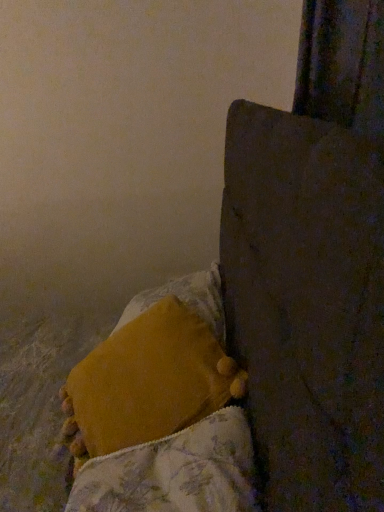
This screenshot has width=384, height=512. What do you see at coordinates (175, 472) in the screenshot?
I see `fluffy yellow blanket at lower left` at bounding box center [175, 472].

You are a GUI agent. You are given a task and a screenshot of the screen. Output one action in this format:
    pyautogui.click(x=<x>, y=<y>)
    Task: Click on the velvety yellow pillow at lower center
    Image resolution: width=384 pixels, height=512 pixels.
    Given the screenshot: What is the action you would take?
    pyautogui.click(x=148, y=382)

Which of these two, velvety yellow pillow at lower center or fluffy yellow blanket at lower left, is wider?

fluffy yellow blanket at lower left is wider.

How different are the orientations of velvety yellow pillow at lower center and fluffy yellow blanket at lower left in degrees?

The angular difference between velvety yellow pillow at lower center and fluffy yellow blanket at lower left is 0.601 degrees.

Based on the photo, is velvety yellow pillow at lower center next to fluffy yellow blanket at lower left?

No, velvety yellow pillow at lower center is not touching fluffy yellow blanket at lower left.

Which of these two, velvety yellow pillow at lower center or fluffy yellow blanket at lower left, is bigger?

velvety yellow pillow at lower center is bigger.

Locate an element on the screen. This screenshot has width=384, height=512. blanket behind the wooden bedpost at upper right is located at coordinates (175, 472).

From a real-world perspective, is fluffy yellow blanket at lower left physically below wooden bedpost at upper right?

Yes, from a real-world perspective, fluffy yellow blanket at lower left is beneath wooden bedpost at upper right.

Which is closer to the camera, (166, 450) or (300, 506)?

Point (166, 450).

Is fluffy yellow blanket at lower left aimed at wooden bedpost at upper right?

Yes, fluffy yellow blanket at lower left is turned towards wooden bedpost at upper right.

Is velvety yellow pillow at lower center to the left or to the right of wooden bedpost at upper right in the image?

Based on their positions, velvety yellow pillow at lower center is located to the right of wooden bedpost at upper right.

From the image's perspective, is velvety yellow pillow at lower center positioned above or below wooden bedpost at upper right?

velvety yellow pillow at lower center is situated lower than wooden bedpost at upper right in the image.

Is velvety yellow pillow at lower center facing away from wooden bedpost at upper right?

Correct, velvety yellow pillow at lower center is looking away from wooden bedpost at upper right.

Is velvety yellow pillow at lower center positioned beyond the bounds of wooden bedpost at upper right?

No, velvety yellow pillow at lower center is inside or overlapping with wooden bedpost at upper right.

Where is `blanket below the wooden bedpost at upper right (from a real-world perspective)`? blanket below the wooden bedpost at upper right (from a real-world perspective) is located at coordinates (175, 472).

Is wooden bedpost at upper right situated inside fluffy yellow blanket at lower left or outside?

wooden bedpost at upper right is spatially situated outside fluffy yellow blanket at lower left.

Between wooden bedpost at upper right and fluffy yellow blanket at lower left, which one is positioned in front?

wooden bedpost at upper right is closer to the camera.

Which is in front, point (228, 169) or point (246, 468)?

The point (246, 468) is in front.

Locate an element on the screen. furniture above the velvety yellow pillow at lower center (from a real-world perspective) is located at coordinates [x=307, y=304].

Is wooden bedpost at upper right to the left of velvety yellow pillow at lower center from the viewer's perspective?

Indeed, wooden bedpost at upper right is positioned on the left side of velvety yellow pillow at lower center.

From a real-world perspective, who is located higher, wooden bedpost at upper right or velvety yellow pillow at lower center?

wooden bedpost at upper right.

Between wooden bedpost at upper right and velvety yellow pillow at lower center, which one has less height?

velvety yellow pillow at lower center is shorter.

Is fluffy yellow blanket at lower left in front of or behind velvety yellow pillow at lower center in the image?

fluffy yellow blanket at lower left is positioned closer to the viewer than velvety yellow pillow at lower center.

Is fluffy yellow blanket at lower left at the right side of velvety yellow pillow at lower center?

Yes.

Locate an element on the screen. The height and width of the screenshot is (512, 384). pillow that appears above the fluffy yellow blanket at lower left (from a real-world perspective) is located at coordinates (148, 382).

At what (x,y) coordinates should I click in order to perform the action: click on furniture on the left of fluffy yellow blanket at lower left. Please return your answer as a coordinate pair (x, y). Looking at the image, I should click on (307, 304).

Considering their positions, is wooden bedpost at upper right positioned closer to velvety yellow pillow at lower center than fluffy yellow blanket at lower left?

Based on the image, fluffy yellow blanket at lower left appears to be nearer to velvety yellow pillow at lower center.

In the scene shown: Considering their positions, is velvety yellow pillow at lower center positioned further to wooden bedpost at upper right than fluffy yellow blanket at lower left?

velvety yellow pillow at lower center is further to wooden bedpost at upper right.

Based on their spatial positions, is fluffy yellow blanket at lower left or wooden bedpost at upper right closer to velvety yellow pillow at lower center?

fluffy yellow blanket at lower left is closer to velvety yellow pillow at lower center.

When comparing their distances from fluffy yellow blanket at lower left, does velvety yellow pillow at lower center or wooden bedpost at upper right seem closer?

velvety yellow pillow at lower center lies closer to fluffy yellow blanket at lower left than the other object.

Estimate the real-world distances between objects in this image. Which object is further from fluffy yellow blanket at lower left, wooden bedpost at upper right or velvety yellow pillow at lower center?

wooden bedpost at upper right is positioned further to the anchor fluffy yellow blanket at lower left.

Based on their spatial positions, is fluffy yellow blanket at lower left or velvety yellow pillow at lower center further from wooden bedpost at upper right?

velvety yellow pillow at lower center is further to wooden bedpost at upper right.

Find the location of `blanket between wooden bedpost at upper right and velvety yellow pillow at lower center along the z-axis`. blanket between wooden bedpost at upper right and velvety yellow pillow at lower center along the z-axis is located at coordinates (175, 472).